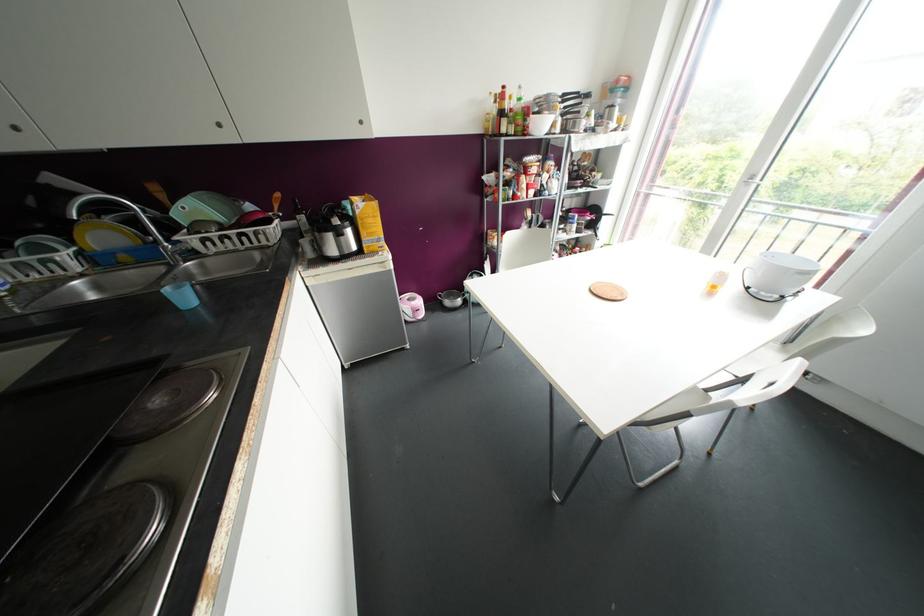
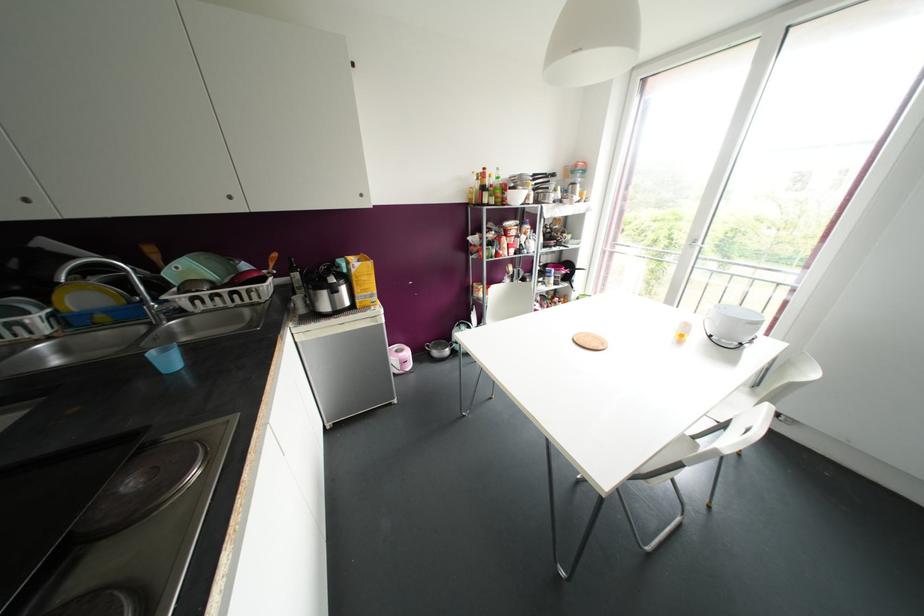
The point at (192, 253) is marked in the first image. Where is the corresponding point in the second image?

(178, 312)